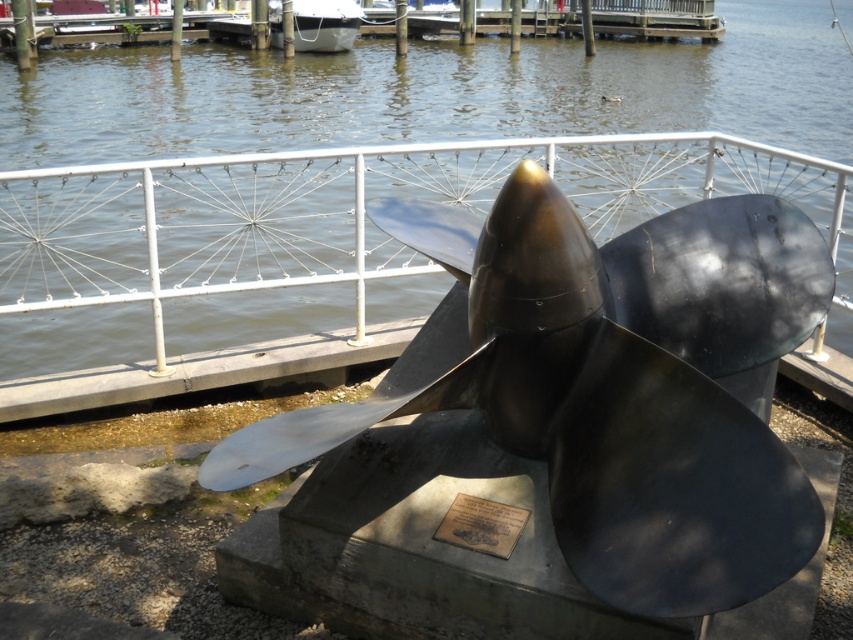
Question: Does metallic water at center have a greater width compared to white glossy boat at upper center?

Choices:
 (A) no
 (B) yes

Answer: (B)

Question: Is polished bronze propeller at center to the right of metallic water at center from the viewer's perspective?

Choices:
 (A) yes
 (B) no

Answer: (B)

Question: Among these points, which one is farthest from the camera?

Choices:
 (A) (54, 330)
 (B) (541, 227)
 (C) (512, 541)

Answer: (A)

Question: Estimate the real-world distances between objects in this image. Which object is closer to the white glossy boat at upper center?

Choices:
 (A) metallic water at center
 (B) bronze plaque at center
 (C) polished bronze propeller at center

Answer: (A)

Question: Among these objects, which one is farthest from the camera?

Choices:
 (A) white glossy boat at upper center
 (B) metallic water at center
 (C) polished bronze propeller at center
 (D) bronze plaque at center

Answer: (A)

Question: Is polished bronze propeller at center to the right of metallic water at center from the viewer's perspective?

Choices:
 (A) yes
 (B) no

Answer: (B)